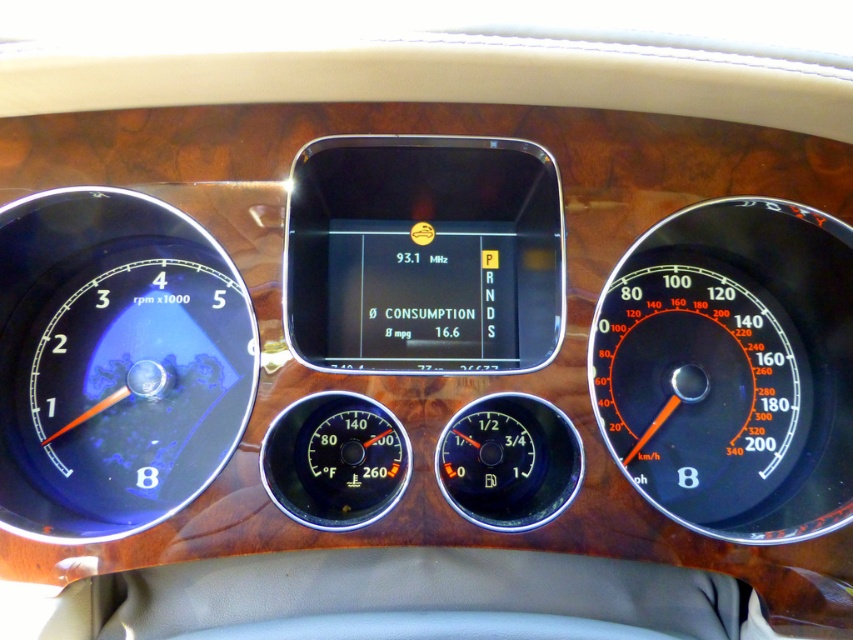
Question: Which is farther from the black plastic speedometer at right?

Choices:
 (A) black glass thermometer at center
 (B) matte black speedometer at left

Answer: (B)

Question: Is the position of black plastic speedometer at right more distant than that of black glass thermometer at center?

Choices:
 (A) no
 (B) yes

Answer: (B)

Question: Is matte black speedometer at left below black glass thermometer at center?

Choices:
 (A) yes
 (B) no

Answer: (B)

Question: Which object is farther from the camera taking this photo?

Choices:
 (A) black plastic speedometer at right
 (B) matte black speedometer at left

Answer: (A)

Question: Where is matte black speedometer at left located in relation to black glass thermometer at center in the image?

Choices:
 (A) right
 (B) left

Answer: (B)

Question: Among these points, which one is farthest from the camera?

Choices:
 (A) (680, 385)
 (B) (166, 237)
 (C) (271, 454)

Answer: (B)